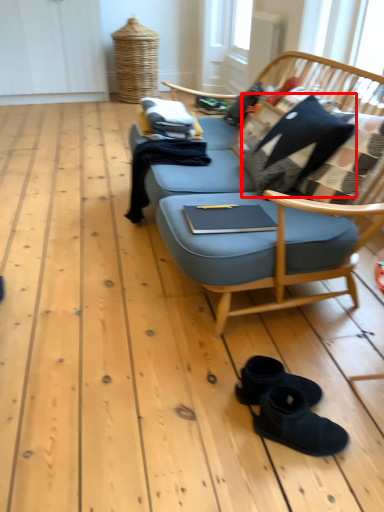
Question: Observing the image, what is the correct spatial positioning of pillow (annotated by the red box) in reference to footwear?

Choices:
 (A) left
 (B) right

Answer: (B)